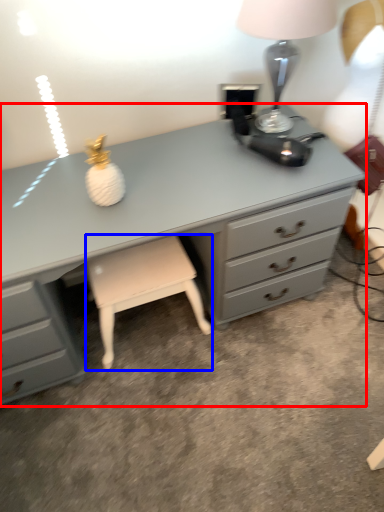
Question: Which of the following is the farthest to the observer, chest of drawers (highlighted by a red box) or stool (highlighted by a blue box)?

Choices:
 (A) chest of drawers
 (B) stool

Answer: (B)